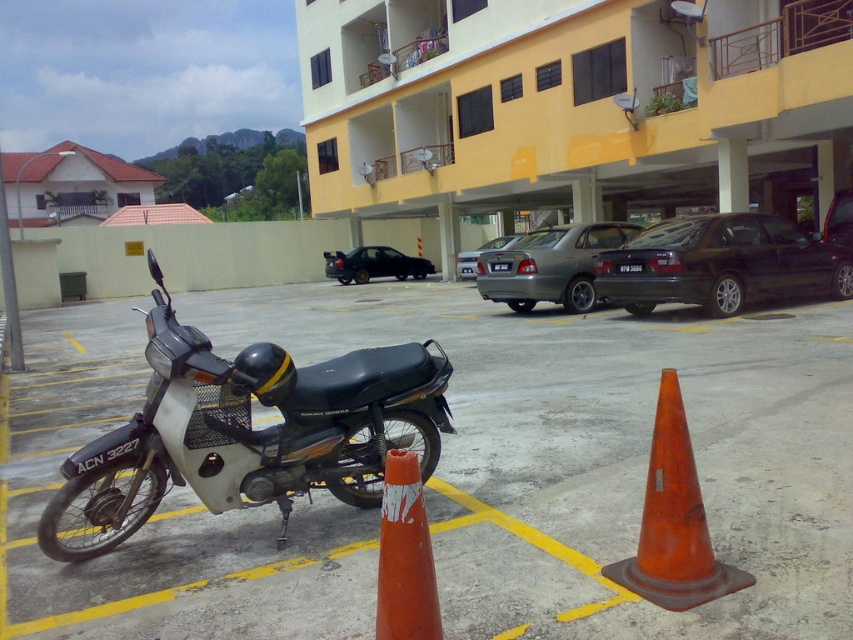
Question: Which of the following is the farthest from the observer?

Choices:
 (A) silver metallic sedan at center
 (B) orange rubber traffic cone at lower right
 (C) white matte motorcycle at left
 (D) black metallic car at right

Answer: (A)

Question: Is yellow matte building at upper center further to camera compared to white matte motorcycle at center?

Choices:
 (A) no
 (B) yes

Answer: (B)

Question: Which of the following is the closest to the observer?

Choices:
 (A) orange rubber traffic cone at lower center
 (B) black metallic car at right

Answer: (A)

Question: Is white matte motorcycle at left behind yellow matte building at upper center?

Choices:
 (A) no
 (B) yes

Answer: (A)

Question: Which object appears closest to the camera in this image?

Choices:
 (A) satin silver sedan at center
 (B) black matte sedan at center

Answer: (A)

Question: In this image, where is white matte motorcycle at left located relative to orange rubber traffic cone at lower right?

Choices:
 (A) below
 (B) above

Answer: (B)